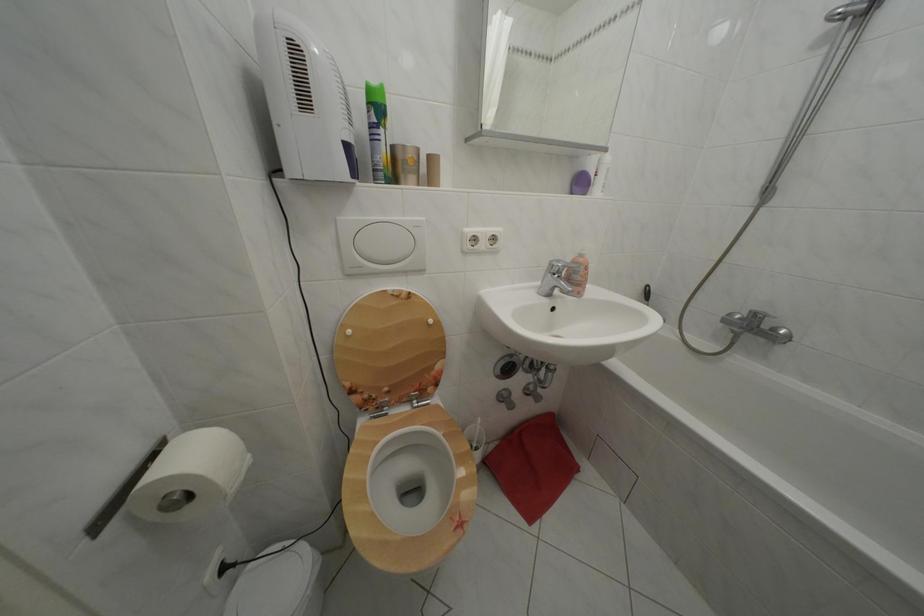
Where is `toilet flush button`? This screenshot has height=616, width=924. toilet flush button is located at coordinates (381, 245).